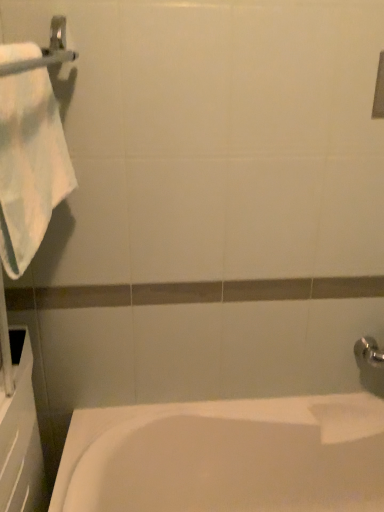
Question: Can you confirm if white glossy bathtub at lower left is shorter than silver metallic towel bar at upper left?

Choices:
 (A) no
 (B) yes

Answer: (A)

Question: Is white glossy bathtub at lower left at the left side of silver metallic towel bar at upper left?

Choices:
 (A) no
 (B) yes

Answer: (A)

Question: Does white glossy bathtub at lower left appear on the right side of silver metallic towel bar at upper left?

Choices:
 (A) yes
 (B) no

Answer: (A)

Question: Is white glossy bathtub at lower left with silver metallic towel bar at upper left?

Choices:
 (A) no
 (B) yes

Answer: (A)

Question: Would you say white glossy bathtub at lower left is outside silver metallic towel bar at upper left?

Choices:
 (A) yes
 (B) no

Answer: (A)

Question: Considering the relative sizes of white glossy bathtub at lower left and silver metallic towel bar at upper left in the image provided, is white glossy bathtub at lower left taller than silver metallic towel bar at upper left?

Choices:
 (A) no
 (B) yes

Answer: (B)

Question: From a real-world perspective, is white cotton towel at left below white glossy bathtub at lower left?

Choices:
 (A) yes
 (B) no

Answer: (B)

Question: Can white glossy bathtub at lower left be found inside white cotton towel at left?

Choices:
 (A) no
 (B) yes

Answer: (A)

Question: Is white cotton towel at left smaller than white glossy bathtub at lower left?

Choices:
 (A) no
 (B) yes

Answer: (B)

Question: Is white cotton towel at left positioned in front of white glossy bathtub at lower left?

Choices:
 (A) no
 (B) yes

Answer: (B)

Question: Does white cotton towel at left turn towards white glossy bathtub at lower left?

Choices:
 (A) yes
 (B) no

Answer: (B)

Question: From the image's perspective, is white cotton towel at left beneath white glossy bathtub at lower left?

Choices:
 (A) yes
 (B) no

Answer: (B)

Question: Is silver metallic towel bar at upper left facing towards white cotton towel at left?

Choices:
 (A) yes
 (B) no

Answer: (B)